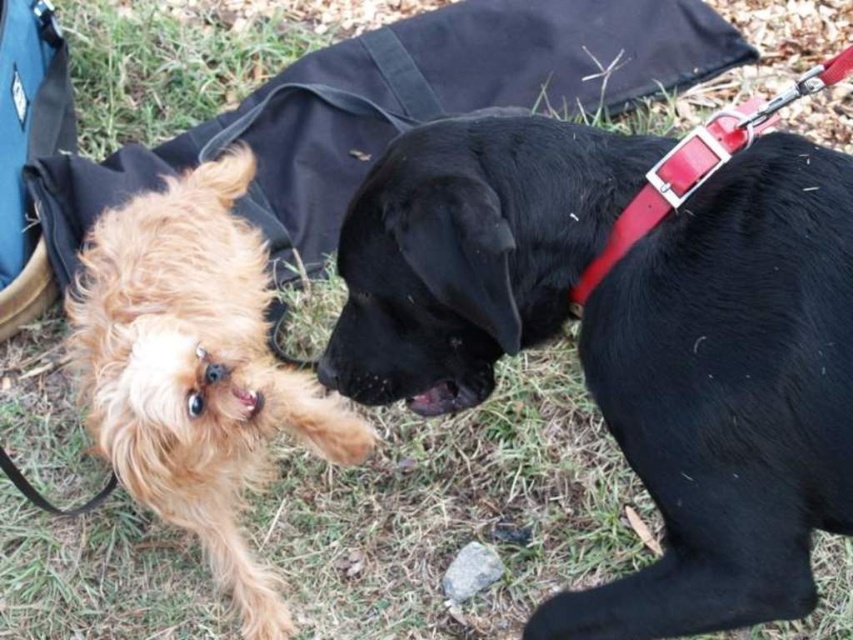
Question: Can you confirm if black smooth dog at center is positioned to the right of golden fur dog at left?

Choices:
 (A) no
 (B) yes

Answer: (B)

Question: Is black smooth dog at center positioned at the back of golden fur dog at left?

Choices:
 (A) no
 (B) yes

Answer: (A)

Question: Is black smooth dog at center below golden fur dog at left?

Choices:
 (A) no
 (B) yes

Answer: (A)

Question: Which point is closer to the camera taking this photo?

Choices:
 (A) (387, 401)
 (B) (236, 193)

Answer: (A)